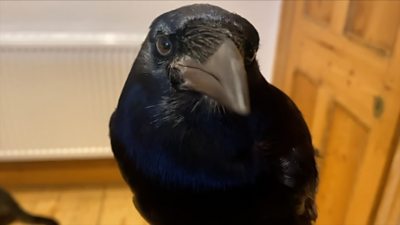
Image resolution: width=400 pixels, height=225 pixels. Identify the location of wall. (96, 15).